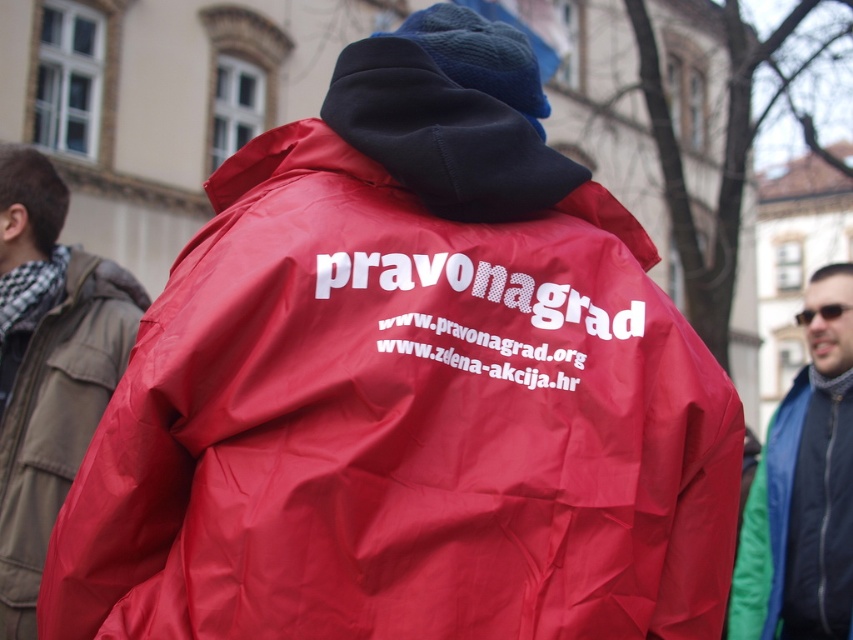
Question: Which object is positioned closest to the sunglasses at center?

Choices:
 (A) shiny blue jacket at right
 (B) matte nylon jacket at center
 (C) matte red jacket at center

Answer: (A)

Question: Can you confirm if matte nylon jacket at center is wider than sunglasses at center?

Choices:
 (A) no
 (B) yes

Answer: (A)

Question: Which point appears closest to the camera in this image?

Choices:
 (A) (839, 316)
 (B) (619, 252)
 (C) (816, 323)
 (D) (80, 412)

Answer: (B)

Question: Can you confirm if matte red jacket at center is wider than sunglasses at center?

Choices:
 (A) no
 (B) yes

Answer: (A)

Question: Estimate the real-world distances between objects in this image. Which object is closer to the matte nylon jacket at center?

Choices:
 (A) matte red jacket at center
 (B) sunglasses at center
 (C) shiny blue jacket at right

Answer: (C)

Question: Does matte nylon jacket at center have a smaller size compared to sunglasses at center?

Choices:
 (A) no
 (B) yes

Answer: (B)